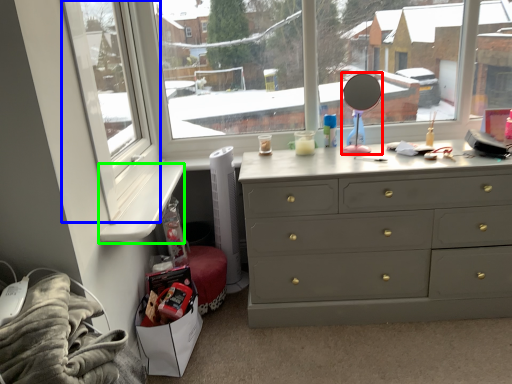
Question: Considering the real-world distances, which object is farthest from mirror (highlighted by a red box)? window frame (highlighted by a blue box) or window sill (highlighted by a green box)?

Choices:
 (A) window frame
 (B) window sill

Answer: (A)